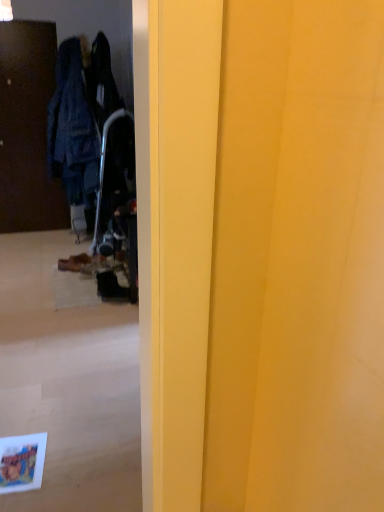
I want to click on free location to the left of brown suede shoe at lower left, so click(46, 269).